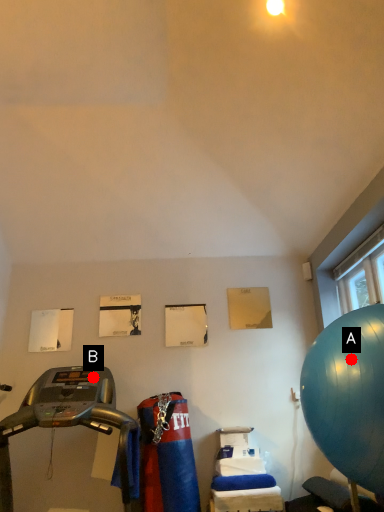
Question: Two points are circled on the image, labeled by A and B beside each circle. Among these points, which one is nearest to the camera?

Choices:
 (A) A is closer
 (B) B is closer

Answer: (A)